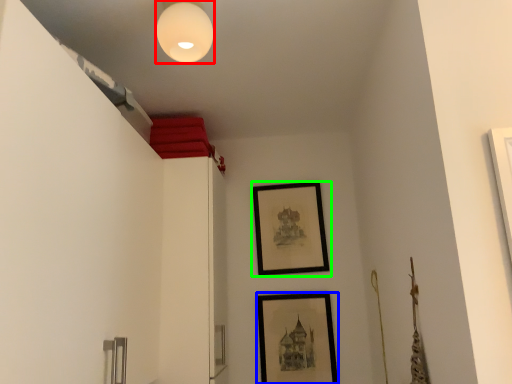
Question: Which object is the closest to the light fixture (highlighted by a red box)? Choose among these: picture frame (highlighted by a blue box) or picture frame (highlighted by a green box).

Choices:
 (A) picture frame
 (B) picture frame

Answer: (B)